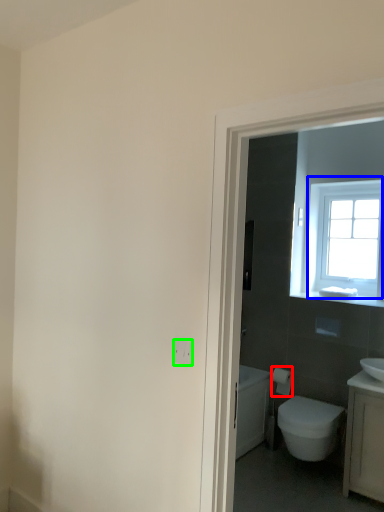
Question: Which object is positioned farthest from toilet paper (highlighted by a red box)? Select from window (highlighted by a blue box) and electric outlet (highlighted by a green box).

Choices:
 (A) window
 (B) electric outlet

Answer: (B)